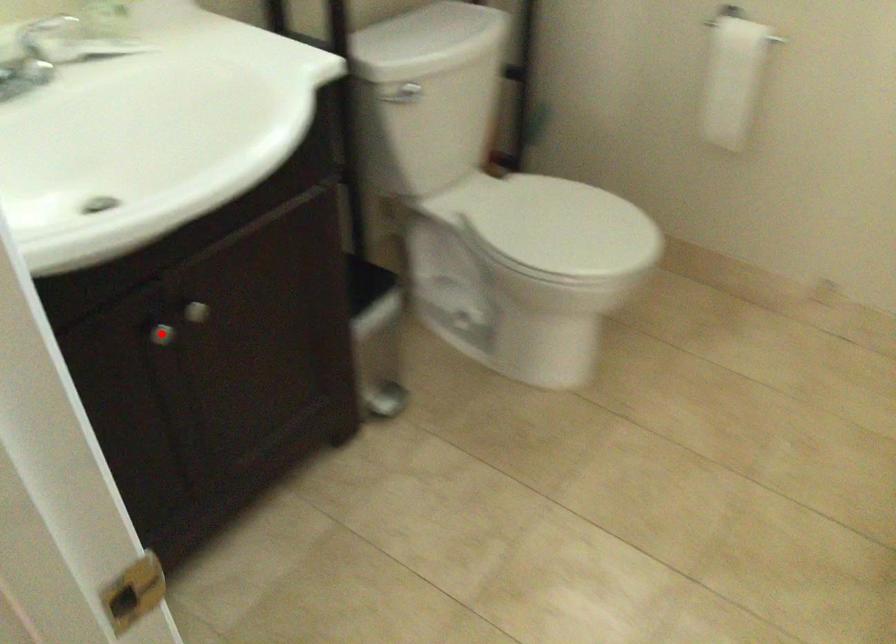
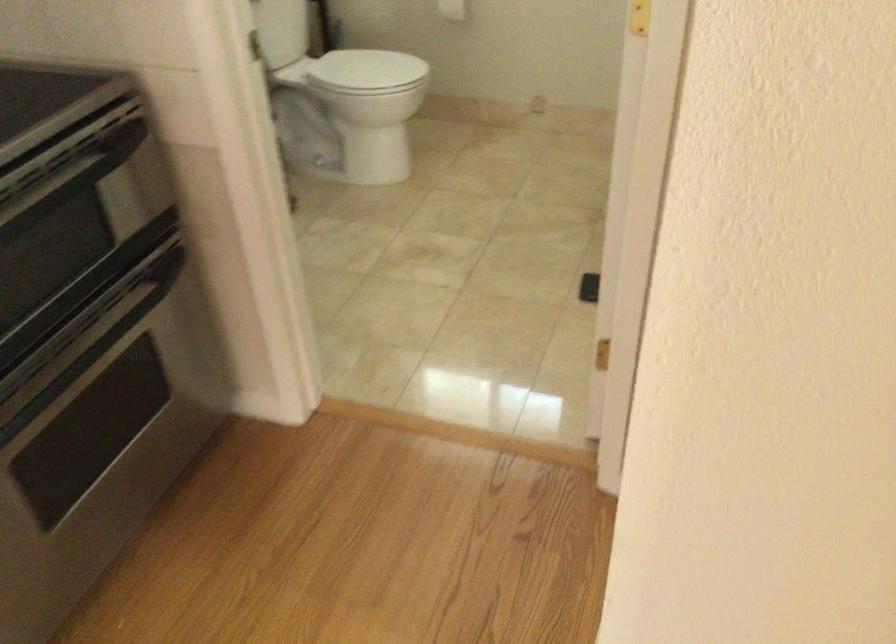
Question: I am providing you with two images of the same scene from different viewpoints. A red point is marked on the first image. At the location where the point appears in image 1, is it still visible in image 2?

Choices:
 (A) Yes
 (B) No

Answer: (B)